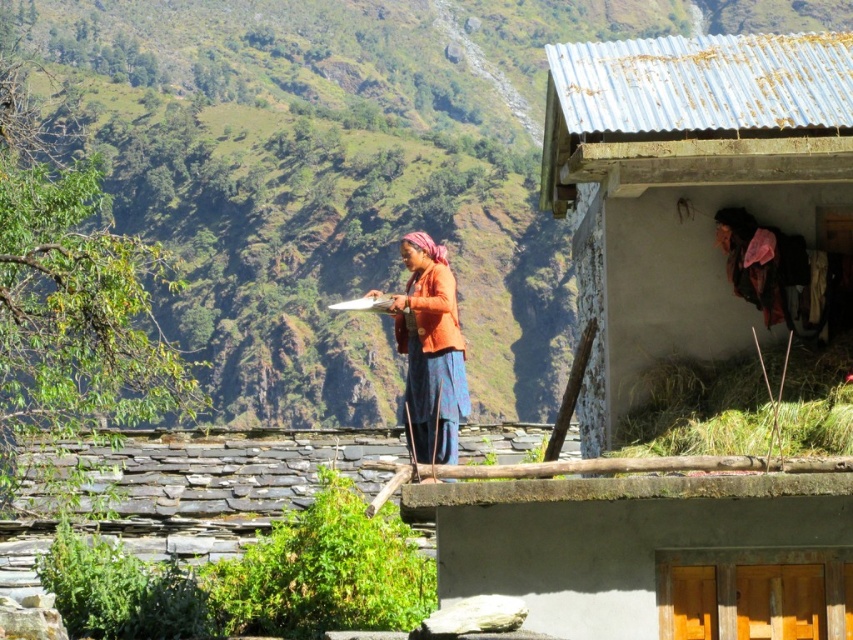
Question: Considering the real-world distances, which object is farthest from the rusty corrugated metal hut at upper right?

Choices:
 (A) green straw at lower right
 (B) green grassy hillside at upper left

Answer: (B)

Question: Does green grassy hillside at upper left appear on the right side of rusty corrugated metal hut at upper right?

Choices:
 (A) yes
 (B) no

Answer: (B)

Question: Which point appears farthest from the camera in this image?

Choices:
 (A) (410, 60)
 (B) (631, 157)
 (C) (734, 364)

Answer: (A)

Question: Estimate the real-world distances between objects in this image. Which object is closer to the orange fabric at center?

Choices:
 (A) green straw at lower right
 (B) green grassy hillside at upper left
 (C) rusty corrugated metal hut at upper right

Answer: (A)

Question: Is rusty corrugated metal hut at upper right positioned in front of orange fabric at center?

Choices:
 (A) no
 (B) yes

Answer: (B)

Question: Does green straw at lower right have a greater width compared to orange fabric at center?

Choices:
 (A) no
 (B) yes

Answer: (A)